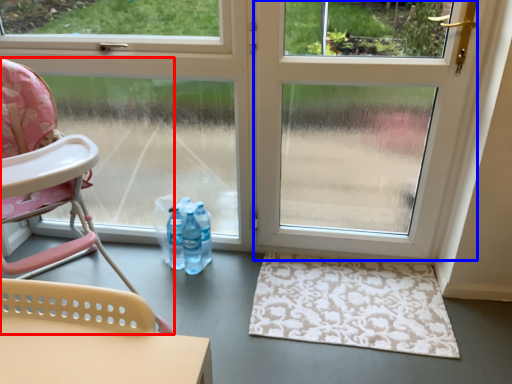
Question: Which point is further to the camera, chair (highlighted by a red box) or screen door (highlighted by a blue box)?

Choices:
 (A) chair
 (B) screen door

Answer: (B)